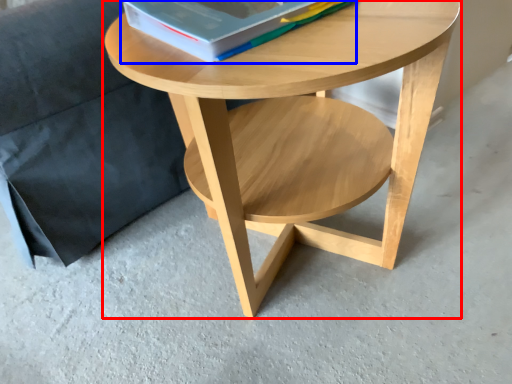
Question: Which object appears closest to the camera in this image, coffee table (highlighted by a red box) or paperback book (highlighted by a blue box)?

Choices:
 (A) coffee table
 (B) paperback book

Answer: (A)